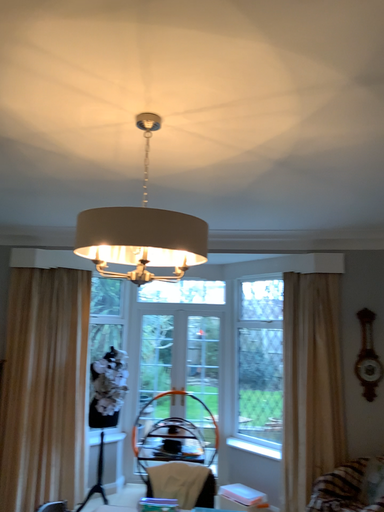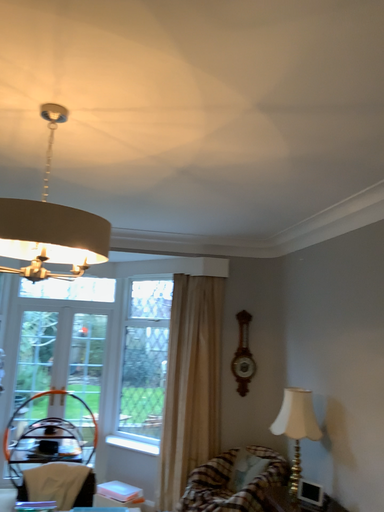
Question: How did the camera likely rotate when shooting the video?

Choices:
 (A) rotated left
 (B) rotated right

Answer: (B)